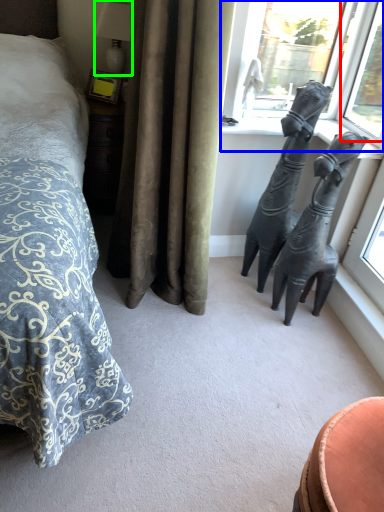
Question: Which object is the farthest from window (highlighted by a red box)? Choose among these: window (highlighted by a blue box) or lamp (highlighted by a green box).

Choices:
 (A) window
 (B) lamp

Answer: (B)